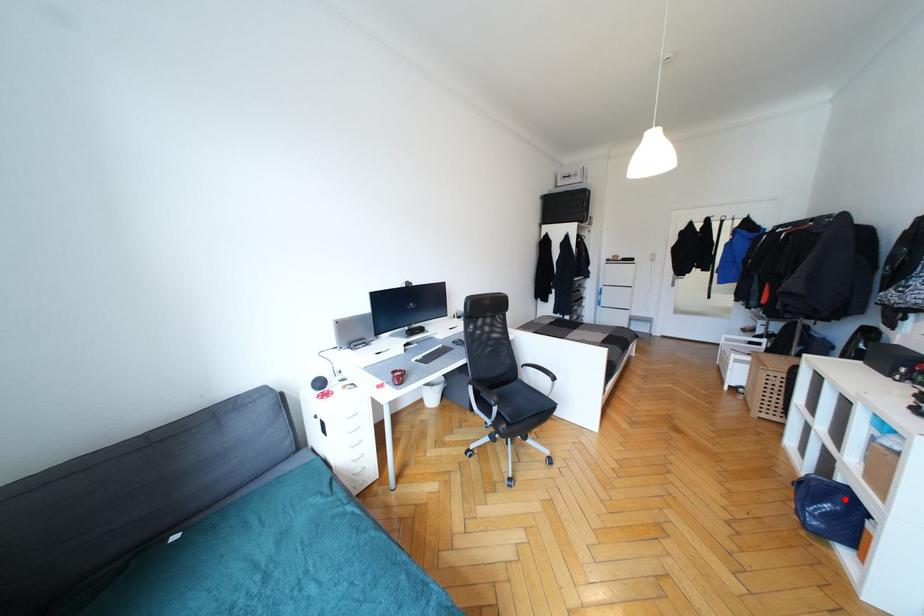
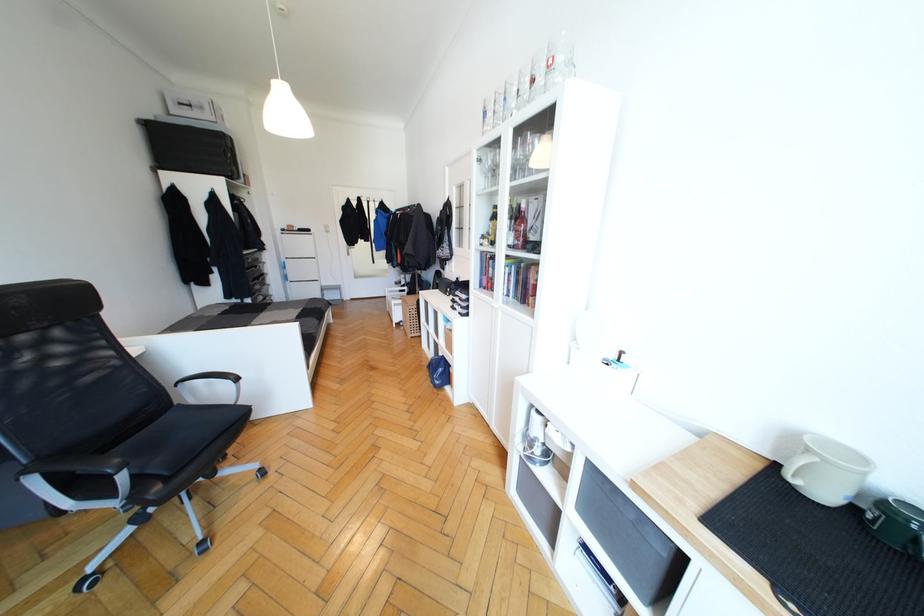
Question: I am providing you with two images of the same scene from different viewpoints. Given a red point in image1, look at the same physical point in image2. Is it:

Choices:
 (A) Closer to the viewpoint
 (B) Farther from the viewpoint

Answer: (A)